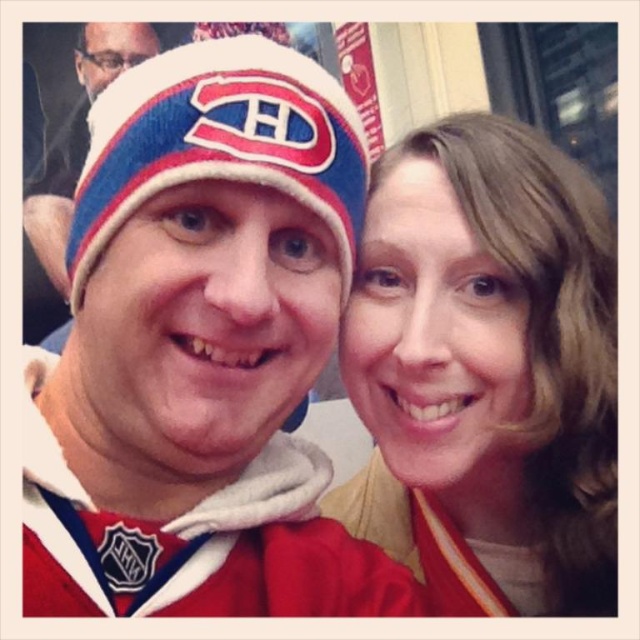
Question: Is matte fabric hat at upper left positioned before blue knit beanie at upper left?

Choices:
 (A) yes
 (B) no

Answer: (A)

Question: Which of the following is the closest to the observer?

Choices:
 (A) matte yellow sweater at center
 (B) blue knit beanie at center
 (C) blue knit beanie at upper left

Answer: (B)

Question: Which point is closer to the camera?

Choices:
 (A) blue knit beanie at upper left
 (B) matte fabric hat at upper left
 (C) blue knit beanie at center
 (D) matte yellow sweater at center

Answer: (B)

Question: Can you confirm if matte yellow sweater at center is positioned to the left of blue knit beanie at center?

Choices:
 (A) yes
 (B) no

Answer: (B)

Question: Does matte fabric hat at upper left come behind blue knit beanie at upper left?

Choices:
 (A) no
 (B) yes

Answer: (A)

Question: Which point is closer to the camera?

Choices:
 (A) (336, 81)
 (B) (381, 316)
 (C) (104, 86)
 (D) (280, 44)

Answer: (A)